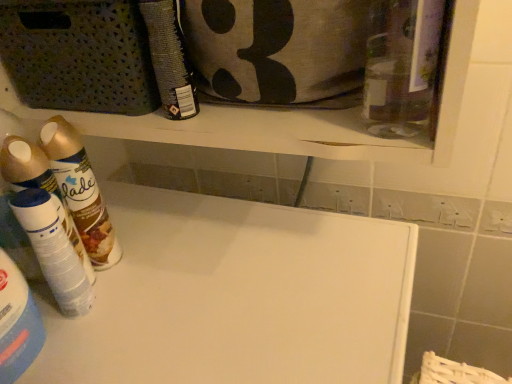
The height and width of the screenshot is (384, 512). I want to click on vacant space to the right of gold metallic spray can at left, the first cleaning product in the left-to-right sequence, so click(x=200, y=250).